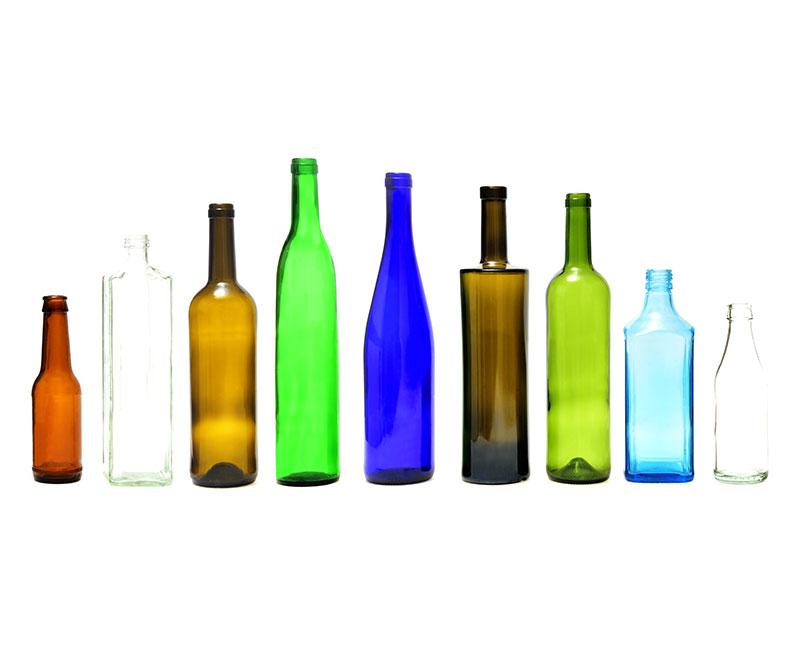
The image size is (795, 647). What are the coordinates of `glass bottles` in the screenshot? It's located at (56, 421), (142, 395), (215, 395), (300, 393), (409, 397), (501, 400), (572, 365), (642, 398), (726, 402).